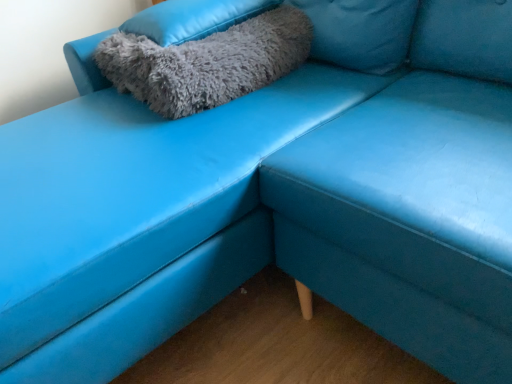
The height and width of the screenshot is (384, 512). I want to click on gray fluffy pillow at upper left, the 1th pillow viewed from the top, so (193, 18).

The height and width of the screenshot is (384, 512). What do you see at coordinates (193, 18) in the screenshot?
I see `gray fluffy pillow at upper left, which ranks as the second pillow in bottom-to-top order` at bounding box center [193, 18].

Where is `gray fluffy pillow at upper left, which ranks as the 2th pillow in top-to-bottom order`? Image resolution: width=512 pixels, height=384 pixels. gray fluffy pillow at upper left, which ranks as the 2th pillow in top-to-bottom order is located at coordinates tap(207, 62).

What do you see at coordinates (207, 62) in the screenshot? This screenshot has height=384, width=512. I see `gray fluffy pillow at upper left, which ranks as the 2th pillow in top-to-bottom order` at bounding box center [207, 62].

Where is `gray fluffy pillow at upper left, the 1th pillow viewed from the top`? gray fluffy pillow at upper left, the 1th pillow viewed from the top is located at coordinates (193, 18).

Considering the positions of objects gray fluffy pillow at upper left, which ranks as the 2th pillow in top-to-bottom order, and gray fluffy pillow at upper left, the 1th pillow viewed from the top, in the image provided, who is more to the left, gray fluffy pillow at upper left, which ranks as the 2th pillow in top-to-bottom order, or gray fluffy pillow at upper left, the 1th pillow viewed from the top,?

From the viewer's perspective, gray fluffy pillow at upper left, which ranks as the 2th pillow in top-to-bottom order, appears more on the left side.

Which is in front, gray fluffy pillow at upper left, which ranks as the 2th pillow in top-to-bottom order, or gray fluffy pillow at upper left, which ranks as the second pillow in bottom-to-top order?

gray fluffy pillow at upper left, which ranks as the 2th pillow in top-to-bottom order.

Which point is more forward, (229,34) or (134,18)?

The point (229,34) is closer.

From the image's perspective, would you say gray fluffy pillow at upper left, which is the first pillow from bottom to top, is positioned over gray fluffy pillow at upper left, the 1th pillow viewed from the top?

No, from the image's perspective, gray fluffy pillow at upper left, which is the first pillow from bottom to top, is not above gray fluffy pillow at upper left, the 1th pillow viewed from the top.

From a real-world perspective, is gray fluffy pillow at upper left, which is the first pillow from bottom to top, positioned above or below gray fluffy pillow at upper left, the 1th pillow viewed from the top?

In terms of real-world spatial position, gray fluffy pillow at upper left, which is the first pillow from bottom to top, is below gray fluffy pillow at upper left, the 1th pillow viewed from the top.

Looking at this image, between gray fluffy pillow at upper left, which is the first pillow from bottom to top, and gray fluffy pillow at upper left, which ranks as the second pillow in bottom-to-top order, which one has smaller width?

gray fluffy pillow at upper left, which is the first pillow from bottom to top.

Considering the sizes of objects gray fluffy pillow at upper left, which ranks as the 2th pillow in top-to-bottom order, and gray fluffy pillow at upper left, which ranks as the second pillow in bottom-to-top order, in the image provided, who is taller, gray fluffy pillow at upper left, which ranks as the 2th pillow in top-to-bottom order, or gray fluffy pillow at upper left, which ranks as the second pillow in bottom-to-top order,?

Standing taller between the two is gray fluffy pillow at upper left, which ranks as the 2th pillow in top-to-bottom order.

Is gray fluffy pillow at upper left, which ranks as the 2th pillow in top-to-bottom order, bigger than gray fluffy pillow at upper left, the 1th pillow viewed from the top?

Yes, gray fluffy pillow at upper left, which ranks as the 2th pillow in top-to-bottom order, is bigger than gray fluffy pillow at upper left, the 1th pillow viewed from the top.

Is gray fluffy pillow at upper left, which ranks as the second pillow in bottom-to-top order, a part of gray fluffy pillow at upper left, which is the first pillow from bottom to top?

No, gray fluffy pillow at upper left, which ranks as the second pillow in bottom-to-top order, is not inside gray fluffy pillow at upper left, which is the first pillow from bottom to top.

Does gray fluffy pillow at upper left, which is the first pillow from bottom to top, touch gray fluffy pillow at upper left, the 1th pillow viewed from the top?

No, gray fluffy pillow at upper left, which is the first pillow from bottom to top, is not in contact with gray fluffy pillow at upper left, the 1th pillow viewed from the top.

Is gray fluffy pillow at upper left, which is the first pillow from bottom to top, oriented away from gray fluffy pillow at upper left, which ranks as the second pillow in bottom-to-top order?

gray fluffy pillow at upper left, which is the first pillow from bottom to top, is not turned away from gray fluffy pillow at upper left, which ranks as the second pillow in bottom-to-top order.

What's the angular difference between gray fluffy pillow at upper left, which is the first pillow from bottom to top, and gray fluffy pillow at upper left, the 1th pillow viewed from the top,'s facing directions?

The angle between the facing direction of gray fluffy pillow at upper left, which is the first pillow from bottom to top, and the facing direction of gray fluffy pillow at upper left, the 1th pillow viewed from the top, is 1.29 degrees.

Locate an element on the screen. pillow above the gray fluffy pillow at upper left, which ranks as the 2th pillow in top-to-bottom order (from a real-world perspective) is located at coordinates (193, 18).

Which is more to the right, gray fluffy pillow at upper left, the 1th pillow viewed from the top, or gray fluffy pillow at upper left, which ranks as the 2th pillow in top-to-bottom order?

Positioned to the right is gray fluffy pillow at upper left, the 1th pillow viewed from the top.

From the picture: Is the position of gray fluffy pillow at upper left, the 1th pillow viewed from the top, less distant than that of gray fluffy pillow at upper left, which ranks as the 2th pillow in top-to-bottom order?

No, gray fluffy pillow at upper left, the 1th pillow viewed from the top, is behind gray fluffy pillow at upper left, which ranks as the 2th pillow in top-to-bottom order.

Does point (190, 6) come in front of point (275, 29)?

No, it is behind (275, 29).

From the image's perspective, is gray fluffy pillow at upper left, which ranks as the second pillow in bottom-to-top order, on gray fluffy pillow at upper left, which ranks as the 2th pillow in top-to-bottom order?

Yes, from the image's perspective, gray fluffy pillow at upper left, which ranks as the second pillow in bottom-to-top order, is on top of gray fluffy pillow at upper left, which ranks as the 2th pillow in top-to-bottom order.

From a real-world perspective, is gray fluffy pillow at upper left, which ranks as the second pillow in bottom-to-top order, positioned under gray fluffy pillow at upper left, which is the first pillow from bottom to top, based on gravity?

Incorrect, from a real-world perspective, gray fluffy pillow at upper left, which ranks as the second pillow in bottom-to-top order, is higher than gray fluffy pillow at upper left, which is the first pillow from bottom to top.

Which of these two, gray fluffy pillow at upper left, which ranks as the second pillow in bottom-to-top order, or gray fluffy pillow at upper left, which is the first pillow from bottom to top, is thinner?

Thinner between the two is gray fluffy pillow at upper left, which is the first pillow from bottom to top.

In terms of height, does gray fluffy pillow at upper left, the 1th pillow viewed from the top, look taller or shorter compared to gray fluffy pillow at upper left, which is the first pillow from bottom to top?

Considering their sizes, gray fluffy pillow at upper left, the 1th pillow viewed from the top, has less height than gray fluffy pillow at upper left, which is the first pillow from bottom to top.

Is gray fluffy pillow at upper left, which ranks as the second pillow in bottom-to-top order, bigger than gray fluffy pillow at upper left, which is the first pillow from bottom to top?

Actually, gray fluffy pillow at upper left, which ranks as the second pillow in bottom-to-top order, might be smaller than gray fluffy pillow at upper left, which is the first pillow from bottom to top.

Is gray fluffy pillow at upper left, the 1th pillow viewed from the top, not inside gray fluffy pillow at upper left, which ranks as the 2th pillow in top-to-bottom order?

Absolutely, gray fluffy pillow at upper left, the 1th pillow viewed from the top, is external to gray fluffy pillow at upper left, which ranks as the 2th pillow in top-to-bottom order.

Is gray fluffy pillow at upper left, the 1th pillow viewed from the top, positioned far away from gray fluffy pillow at upper left, which is the first pillow from bottom to top?

They are positioned close to each other.

Is gray fluffy pillow at upper left, the 1th pillow viewed from the top, facing away from gray fluffy pillow at upper left, which ranks as the 2th pillow in top-to-bottom order?

That's not correct — gray fluffy pillow at upper left, the 1th pillow viewed from the top, is not looking away from gray fluffy pillow at upper left, which ranks as the 2th pillow in top-to-bottom order.

From the picture: Can you tell me how much gray fluffy pillow at upper left, the 1th pillow viewed from the top, and gray fluffy pillow at upper left, which is the first pillow from bottom to top, differ in facing direction?

1.29 degrees.

The width and height of the screenshot is (512, 384). There is a gray fluffy pillow at upper left, which ranks as the 2th pillow in top-to-bottom order. Identify the location of pillow above it (from a real-world perspective). (193, 18).

Identify the location of pillow that appears on the right of gray fluffy pillow at upper left, which ranks as the 2th pillow in top-to-bottom order. The width and height of the screenshot is (512, 384). (193, 18).

Where is `pillow below the gray fluffy pillow at upper left, the 1th pillow viewed from the top (from a real-world perspective)`? The width and height of the screenshot is (512, 384). pillow below the gray fluffy pillow at upper left, the 1th pillow viewed from the top (from a real-world perspective) is located at coordinates (207, 62).